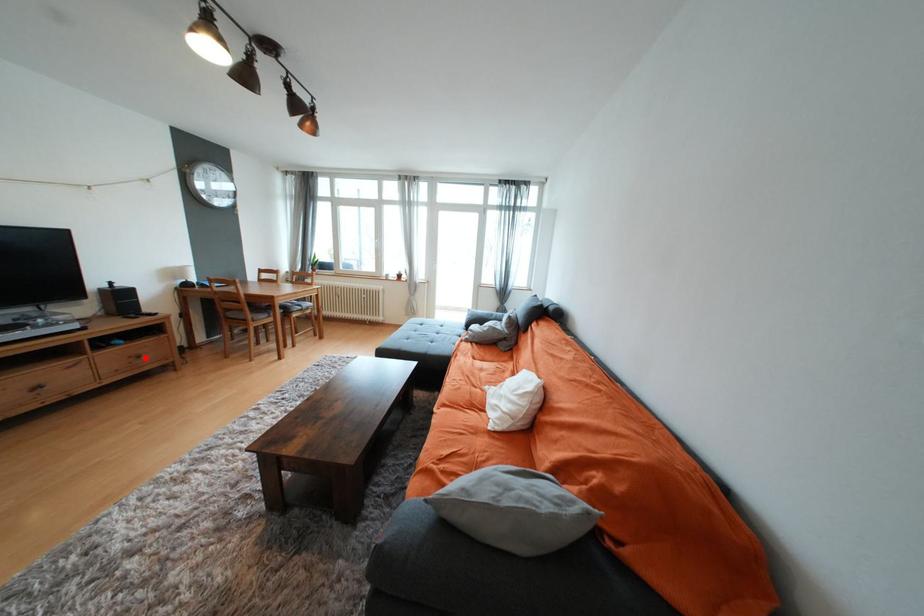
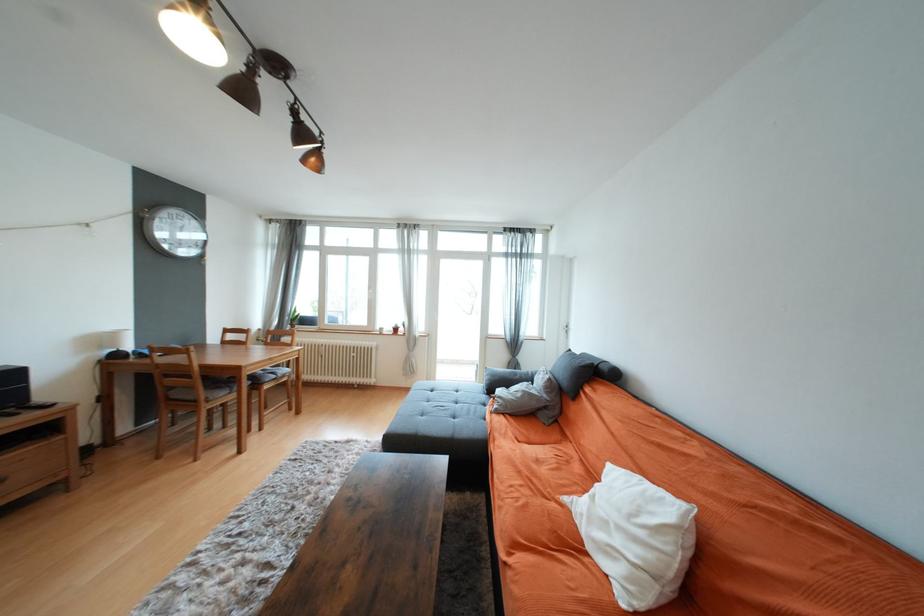
Question: I am providing you with two images of the same scene from different viewpoints. A red point is shown in image1. For the corresponding object point in image2, is it positioned nearer or farther from the camera?

Choices:
 (A) Nearer
 (B) Farther

Answer: (A)